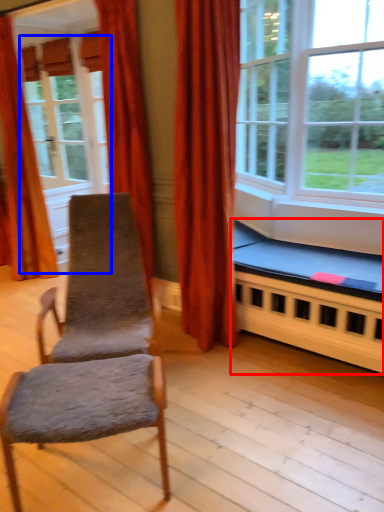
Question: Which object is further to the camera taking this photo, bed frame (highlighted by a red box) or screen door (highlighted by a blue box)?

Choices:
 (A) bed frame
 (B) screen door

Answer: (B)